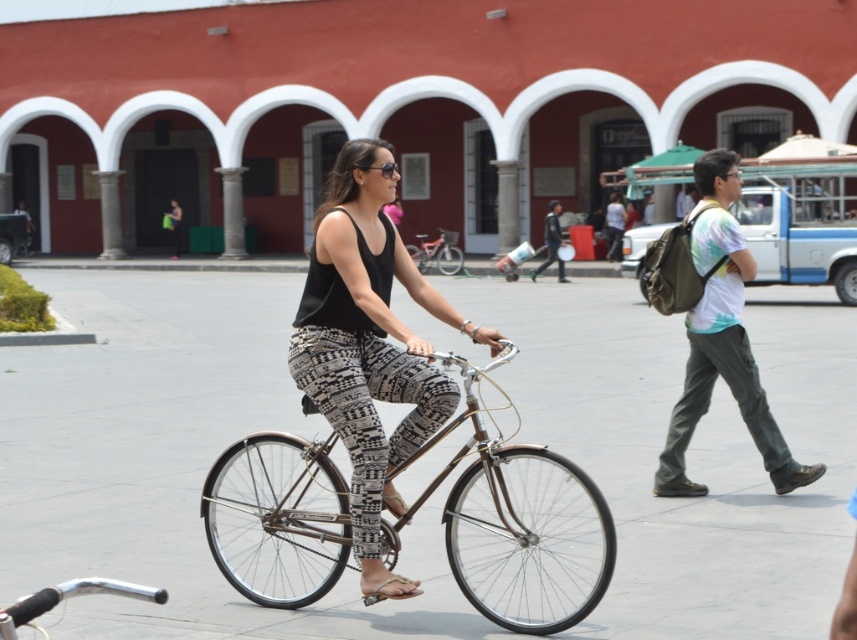
In the scene shown: You are a delivery person who needs to load a light brown leather jacket at center onto a shiny chrome bicycle at center. Considering the height difference between them, will the jacket fit on the bicycle without any adjustments?

The shiny chrome bicycle at center is much taller than the light brown leather jacket at center, so the jacket will fit on the shiny chrome bicycle at center without any adjustments needed.

In the scene shown: You are a delivery person who needs to park your shiny metallic bicycle at center near the red building with white arched doorways. Based on the coordinates provided, can you determine if the bicycle is already positioned close enough to the red building?

The shiny metallic bicycle at center is located at point (436, 252). Since the red building is in the background, the bicycle is not positioned close enough to the red building.